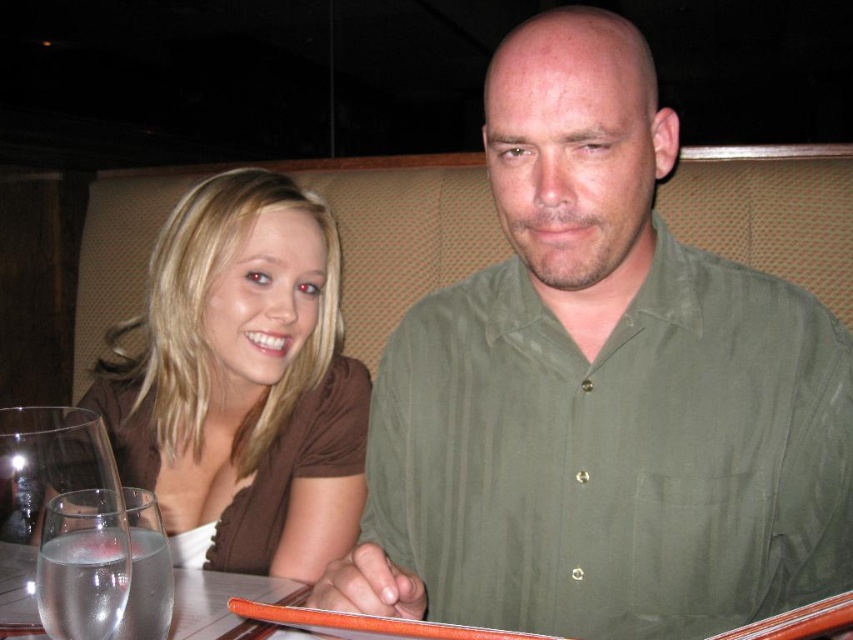
Question: Which of the following is the farthest from the observer?

Choices:
 (A) (67, 570)
 (B) (811, 566)
 (C) (3, 570)

Answer: (B)

Question: Does brown matte shirt at upper left have a smaller size compared to clear glass wine glass at lower left?

Choices:
 (A) yes
 (B) no

Answer: (B)

Question: Among these points, which one is nearest to the camera?

Choices:
 (A) (26, 554)
 (B) (28, 532)
 (C) (560, 490)
 (D) (143, 564)

Answer: (B)

Question: Which of the following is the closest to the observer?

Choices:
 (A) clear glass water at lower left
 (B) clear glass wine glass at lower left

Answer: (B)

Question: Is clear glass at lower left thinner than clear glass water at lower left?

Choices:
 (A) yes
 (B) no

Answer: (A)

Question: Is green matte shirt at center above clear glass wine glass at lower left?

Choices:
 (A) no
 (B) yes

Answer: (B)